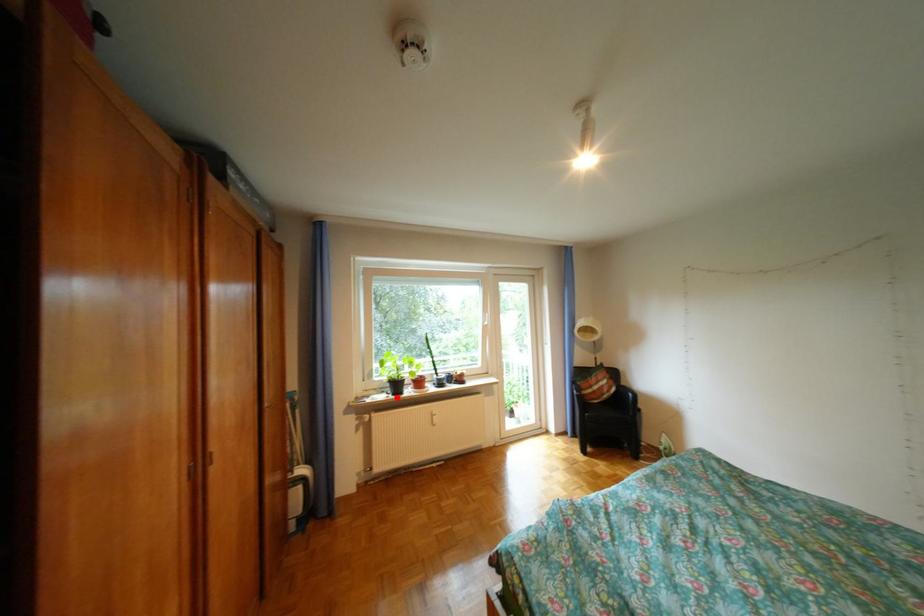
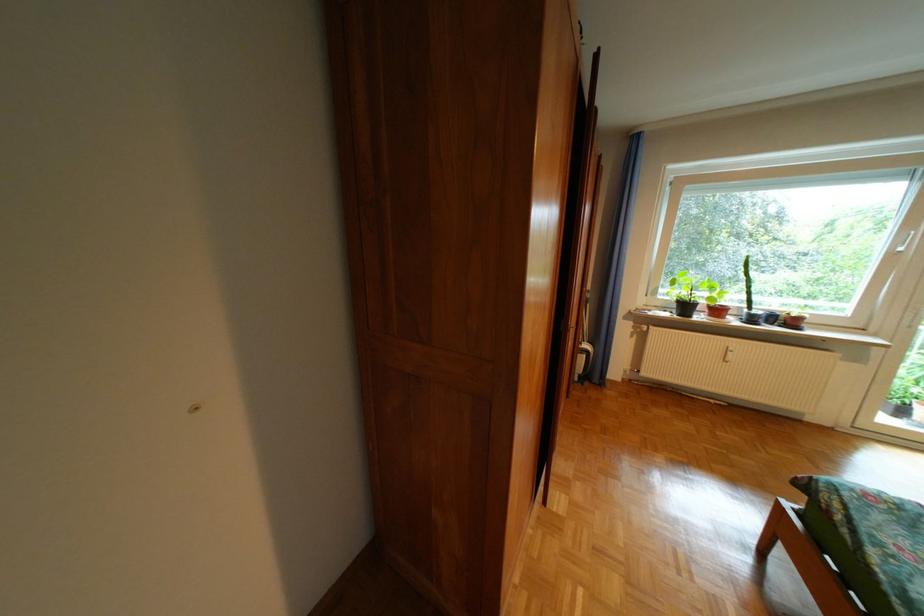
The point at the highlighted location is marked in the first image. Where is the corresponding point in the second image?

(679, 315)